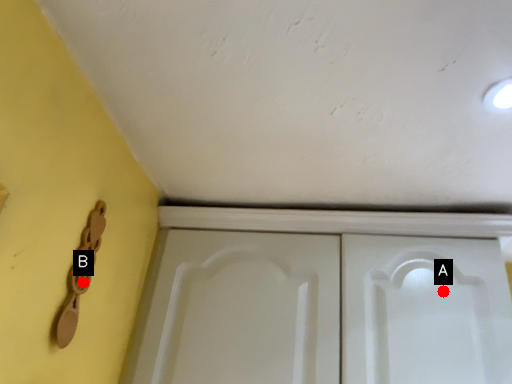
Question: Two points are circled on the image, labeled by A and B beside each circle. Among these points, which one is farthest from the camera?

Choices:
 (A) A is further
 (B) B is further

Answer: (A)